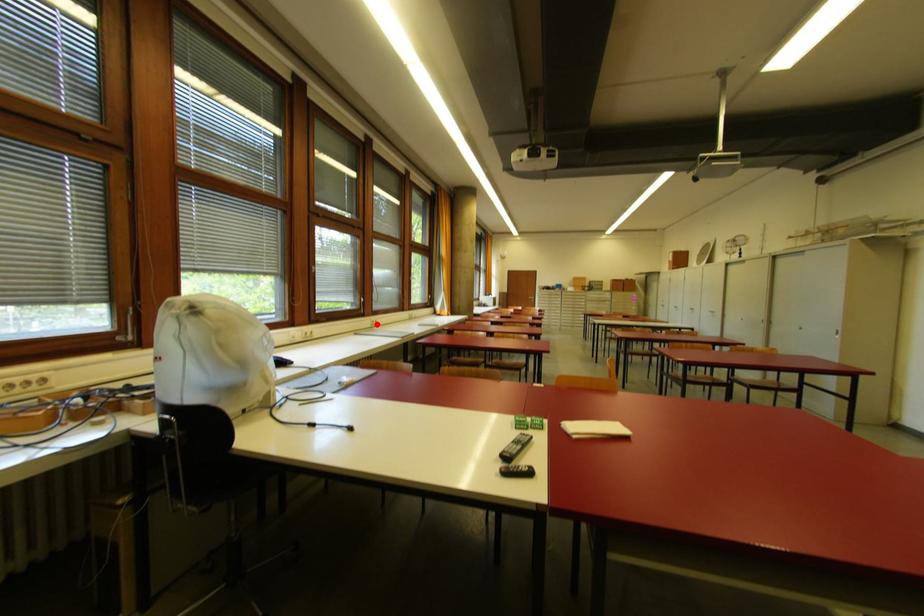
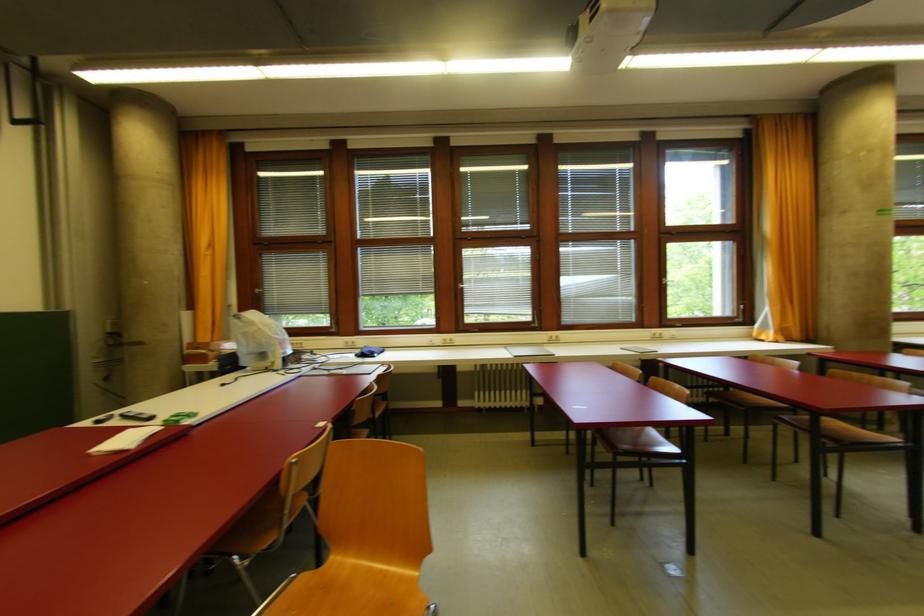
Question: I am providing you with two images of the same scene from different viewpoints. Given a red point in image1, look at the same physical point in image2. Is it:

Choices:
 (A) Closer to the viewpoint
 (B) Farther from the viewpoint

Answer: (B)